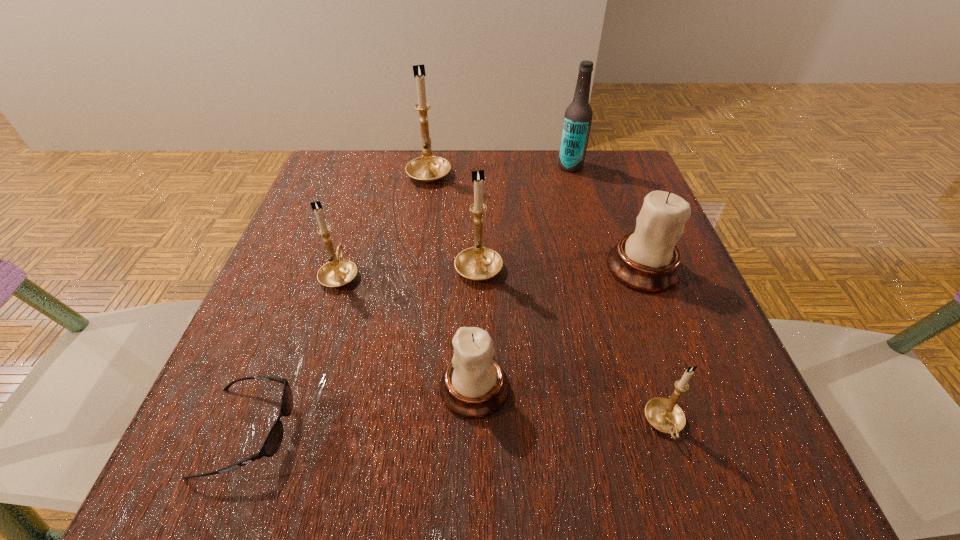
Identify the location of the farthest candle holder. Image resolution: width=960 pixels, height=540 pixels. (428, 168).

Image resolution: width=960 pixels, height=540 pixels. In order to click on the farthest gold candle holder in this screenshot , I will do `click(428, 168)`.

This screenshot has width=960, height=540. In order to click on beer bottle in this screenshot , I will do `click(578, 116)`.

This screenshot has height=540, width=960. Find the location of `the third smallest gold candle holder`. the third smallest gold candle holder is located at coordinates (478, 263).

Locate an element on the screen. This screenshot has width=960, height=540. the fifth shortest candle holder is located at coordinates (478, 263).

Locate an element on the screen. The image size is (960, 540). the farther white candle holder is located at coordinates (647, 260).

Identify the location of the right white candle holder. pyautogui.click(x=647, y=260).

The image size is (960, 540). Identify the location of the third biggest gold candle holder. (338, 272).

This screenshot has width=960, height=540. In order to click on the leftmost gold candle holder in this screenshot , I will do `click(338, 272)`.

At what (x,y) coordinates should I click in order to perform the action: click on the nearer white candle holder. Please return your answer as a coordinate pair (x, y). Looking at the image, I should click on (474, 385).